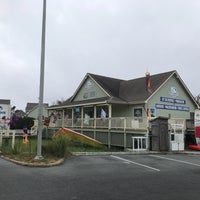
Identify the location of wall. The image size is (200, 200). (167, 92).